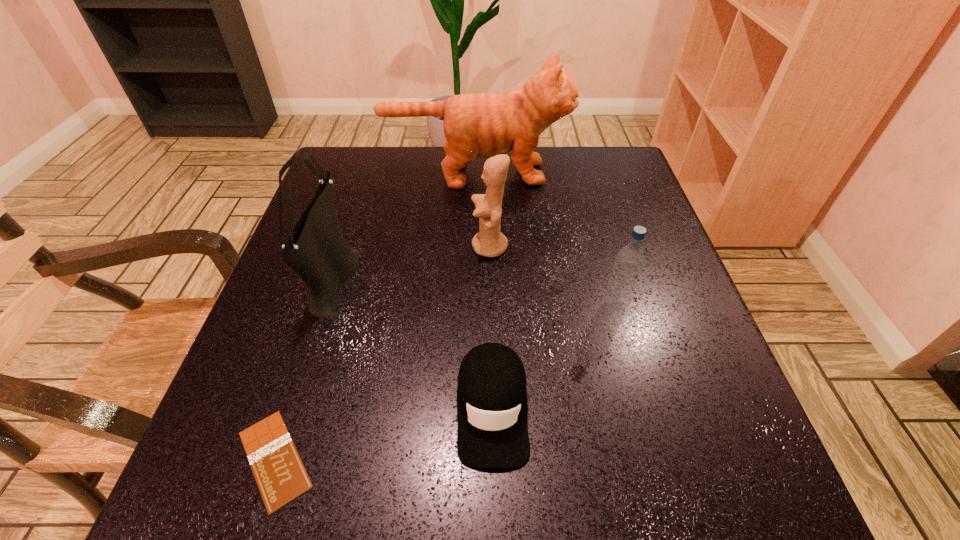
Where is `cat`? The image size is (960, 540). cat is located at coordinates (483, 125).

Identify the location of shoulder bag. (316, 250).

This screenshot has height=540, width=960. I want to click on figurine, so 490,242.

This screenshot has height=540, width=960. I want to click on water bottle, so click(629, 261).

Locate an element on the screen. Image resolution: width=960 pixels, height=540 pixels. the third shortest object is located at coordinates click(x=629, y=261).

Locate an element on the screen. The width and height of the screenshot is (960, 540). the fifth tallest object is located at coordinates (492, 432).

This screenshot has width=960, height=540. In order to click on chocolate bar in this screenshot , I will do `click(281, 477)`.

Locate an element on the screen. The height and width of the screenshot is (540, 960). vacant position located on the face of the cat is located at coordinates (602, 173).

Where is `vacant space situated on the left of the shoulder bag`? vacant space situated on the left of the shoulder bag is located at coordinates (283, 277).

Where is `vacant area located 0.210m on the front-facing side of the figurine`? This screenshot has width=960, height=540. vacant area located 0.210m on the front-facing side of the figurine is located at coordinates (374, 247).